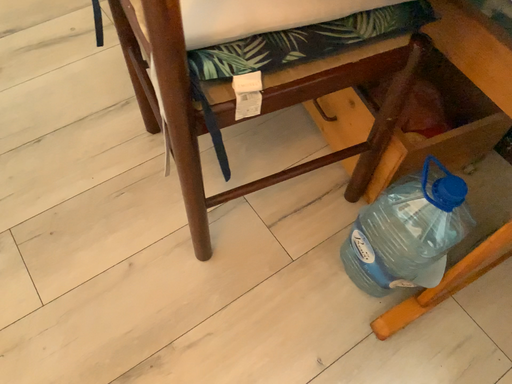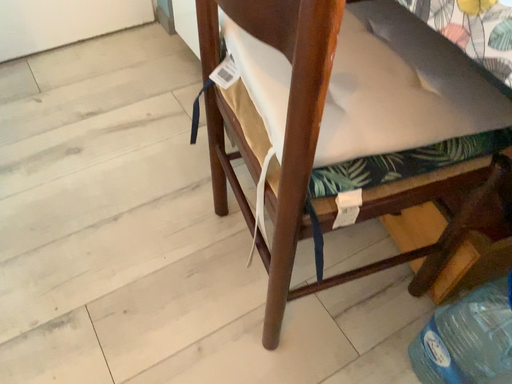
Question: How did the camera likely rotate when shooting the video?

Choices:
 (A) rotated upward
 (B) rotated downward

Answer: (A)